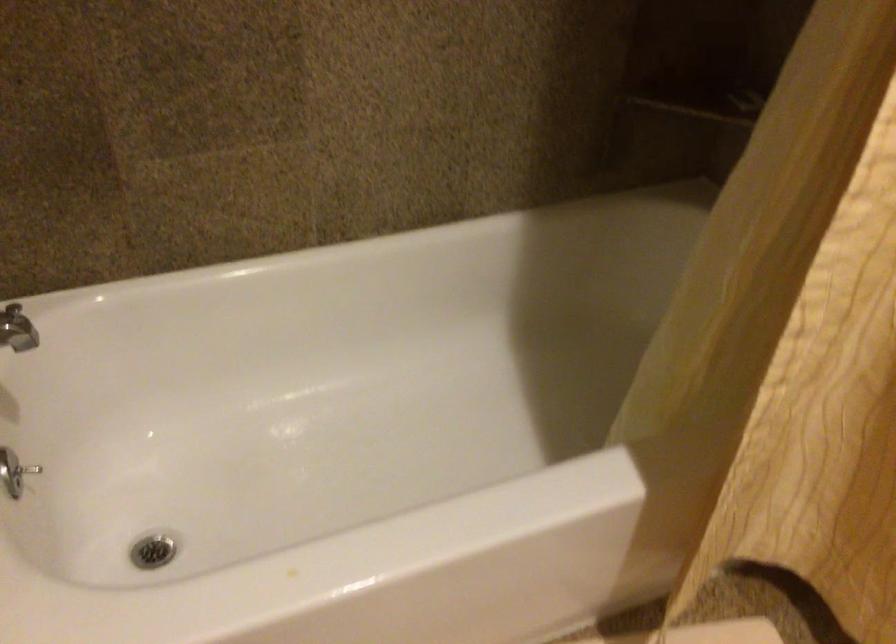
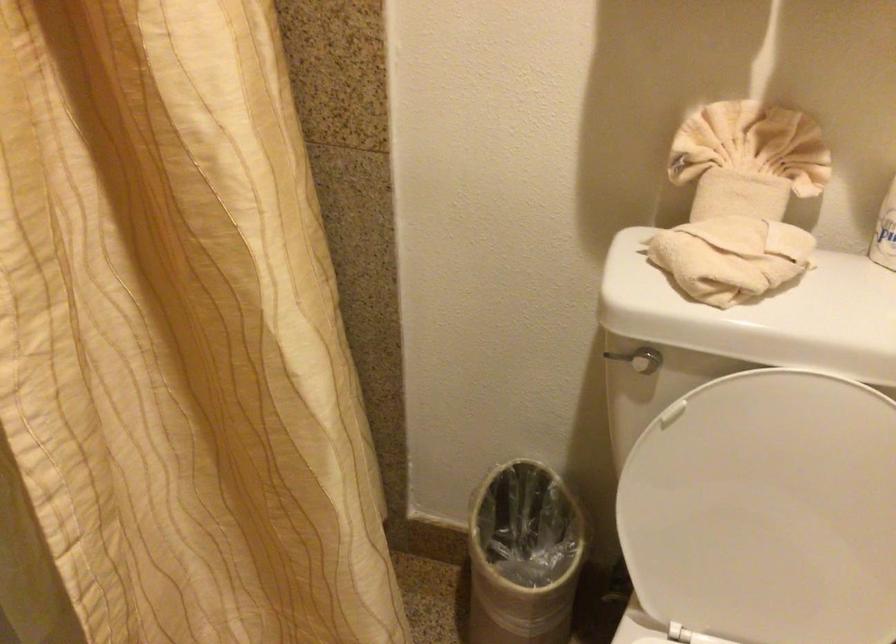
Question: How did the camera likely rotate?

Choices:
 (A) Left
 (B) Right
 (C) Up
 (D) Down

Answer: (B)